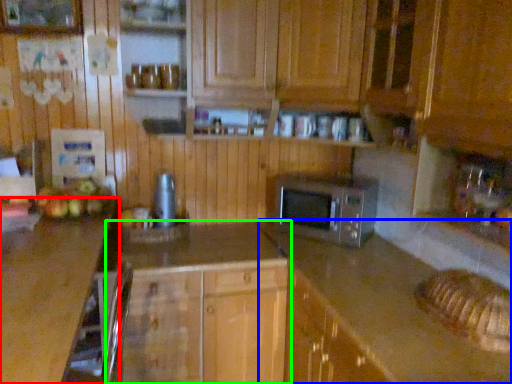
Question: Which object is the closest to the countertop (highlighted by a red box)? Choose among these: counter (highlighted by a blue box) or cabinetry (highlighted by a green box).

Choices:
 (A) counter
 (B) cabinetry

Answer: (B)